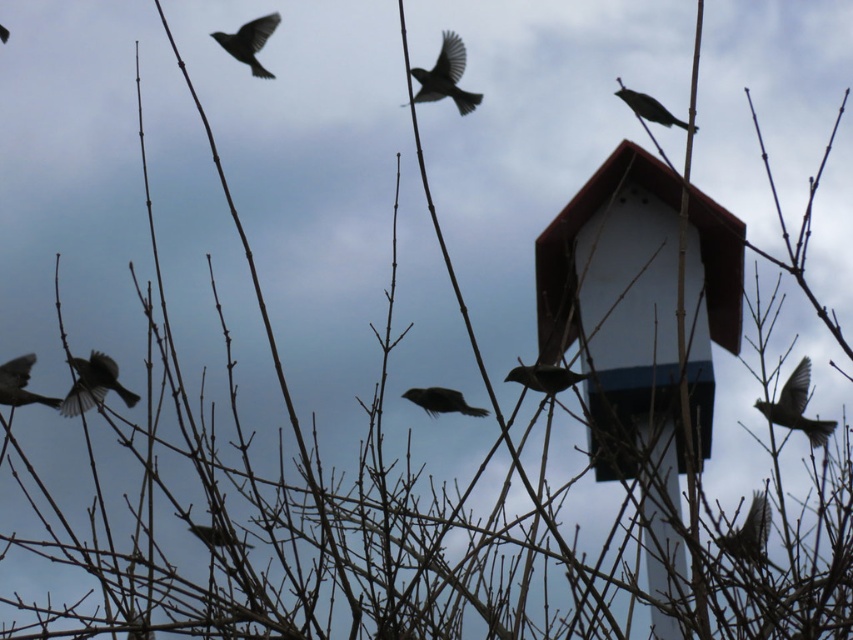
Is point (802, 394) more distant than point (433, 392)?

Yes, point (802, 394) is farther from viewer.

Is gray feathered bird at right wider than silvery metallic bird at center?

Indeed, gray feathered bird at right has a greater width compared to silvery metallic bird at center.

The image size is (853, 640). Find the location of `gray feathered bird at right`. gray feathered bird at right is located at coordinates (796, 406).

Find the location of a particular element. This screenshot has height=640, width=853. gray feathered bird at right is located at coordinates (796, 406).

Which is behind, point (88, 362) or point (643, 106)?

Point (643, 106)

Does point (123, 394) come behind point (635, 102)?

No, it is not.

Where is `dark gray feathers at left`? The width and height of the screenshot is (853, 640). dark gray feathers at left is located at coordinates (93, 385).

Is dark gray feathers at left further to camera compared to matte gray bird at left?

That is False.

Measure the distance between point (99,392) and camera.

The distance of point (99,392) from camera is 11.18 feet.

The height and width of the screenshot is (640, 853). I want to click on dark gray feathers at left, so click(x=93, y=385).